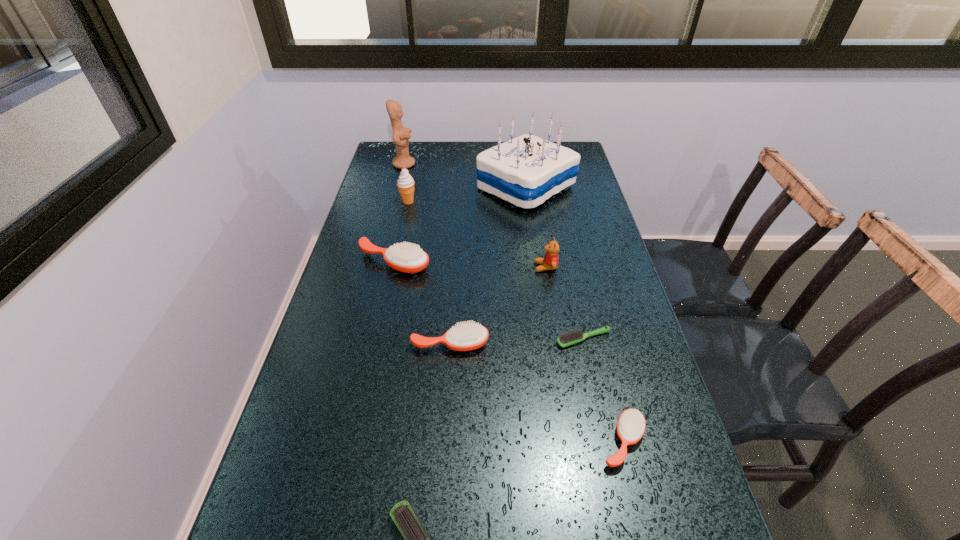
Where is `free location located on the front of the biggest orange hairbrush`? free location located on the front of the biggest orange hairbrush is located at coordinates (373, 356).

Where is `blank area located on the left of the second nearest orange hairbrush`? Image resolution: width=960 pixels, height=540 pixels. blank area located on the left of the second nearest orange hairbrush is located at coordinates (386, 343).

I want to click on free location located on the left of the second nearest hairbrush, so click(533, 441).

You are a GUI agent. You are given a task and a screenshot of the screen. Output one action in this format:
    pyautogui.click(x=<x>, y=<y>)
    Task: Click on the vacant space situated 0.170m on the left of the shortest hairbrush
    This screenshot has width=960, height=540.
    Given the screenshot: What is the action you would take?
    click(x=485, y=339)

Where is `figurine at the far edge`? The height and width of the screenshot is (540, 960). figurine at the far edge is located at coordinates (401, 135).

At what (x,y) coordinates should I click in order to perform the action: click on birthday cake positioned at the far edge. Please return your answer as a coordinate pair (x, y). This screenshot has width=960, height=540. Looking at the image, I should click on (527, 170).

At what (x,y) coordinates should I click in order to perform the action: click on figurine that is positioned at the left edge. Please return your answer as a coordinate pair (x, y). Looking at the image, I should click on (401, 135).

At what (x,y) coordinates should I click in order to perform the action: click on icecream located in the left edge section of the desktop. Please return your answer as a coordinate pair (x, y). The width and height of the screenshot is (960, 540). Looking at the image, I should click on (405, 183).

Locate an element on the screen. Image resolution: width=960 pixels, height=540 pixels. hairbrush at the left edge is located at coordinates (408, 258).

The height and width of the screenshot is (540, 960). In order to click on birthday cake present at the right edge in this screenshot , I will do `click(527, 170)`.